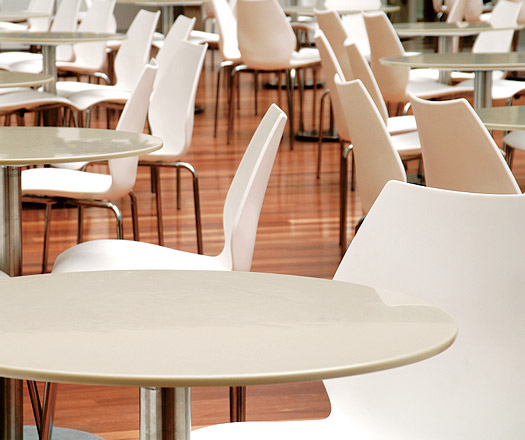
You are a GUI agent. You are given a task and a screenshot of the screen. Output one action in this format:
    pyautogui.click(x=<x>, y=<y>)
    Task: Click on the tables
    This screenshot has height=440, width=525.
    Given the screenshot: What is the action you would take?
    pyautogui.click(x=153, y=302), pyautogui.click(x=51, y=141), pyautogui.click(x=48, y=36), pyautogui.click(x=16, y=14), pyautogui.click(x=298, y=6), pyautogui.click(x=470, y=27), pyautogui.click(x=474, y=60), pyautogui.click(x=504, y=113)